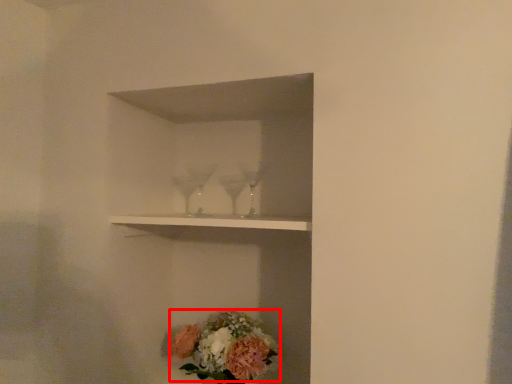
Question: From the image's perspective, where is flower (annotated by the red box) located relative to shelf?

Choices:
 (A) above
 (B) below

Answer: (B)